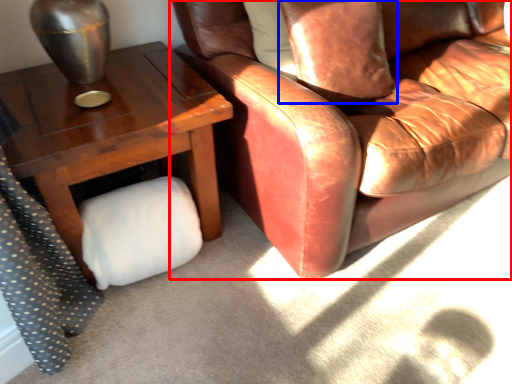
Question: Which object appears farthest to the camera in this image, chair (highlighted by a red box) or pillow (highlighted by a blue box)?

Choices:
 (A) chair
 (B) pillow

Answer: (B)